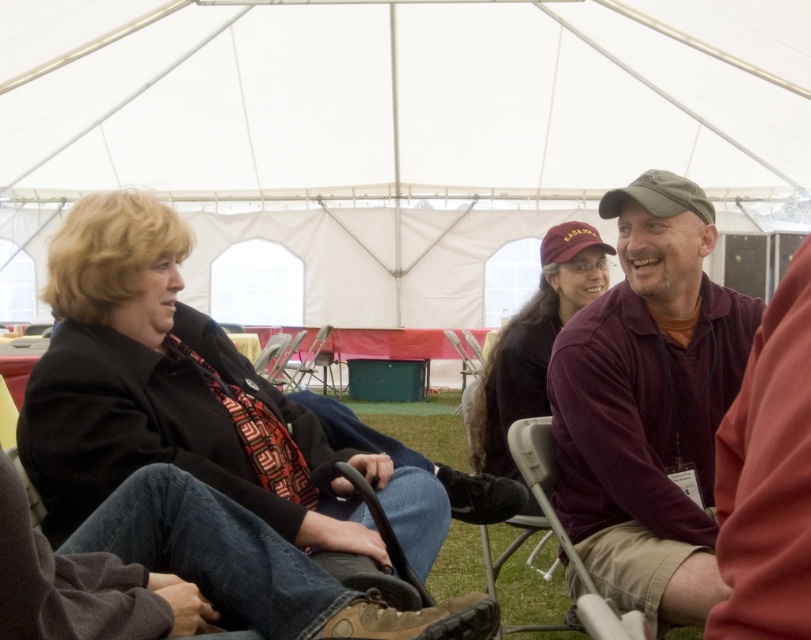
You are a photographer standing 3 meters away from the two subjects wearing the matte black jacket at center and the maroon jersey at center. You want to take a photo that captures both of them in the frame without any distortion. Given the distance between them, is it feasible to include both in a single shot with your standard camera lens? Please explain your reasoning.

The matte black jacket at center and the maroon jersey at center are 69.78 centimeters apart. With a standard camera lens, which typically has a focal length of around 50mm, the field of view at 3 meters would allow capturing objects within a span of about 1.5 meters. Since 69.78 centimeters is well within this range, it is feasible to include both subjects in a single shot without distortion.

You are a photographer at the event and want to take a photo of the matte black jacket at center and the maroon jersey at center. Which one is closer to the camera?

The matte black jacket at center is positioned under the maroon jersey at center, so the maroon jersey at center is closer to the camera.